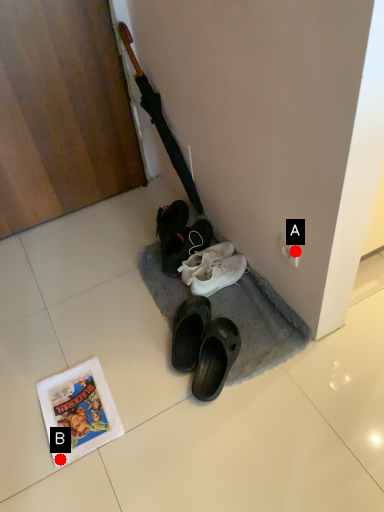
Question: Two points are circled on the image, labeled by A and B beside each circle. Which point is farther from the camera taking this photo?

Choices:
 (A) A is further
 (B) B is further

Answer: (A)